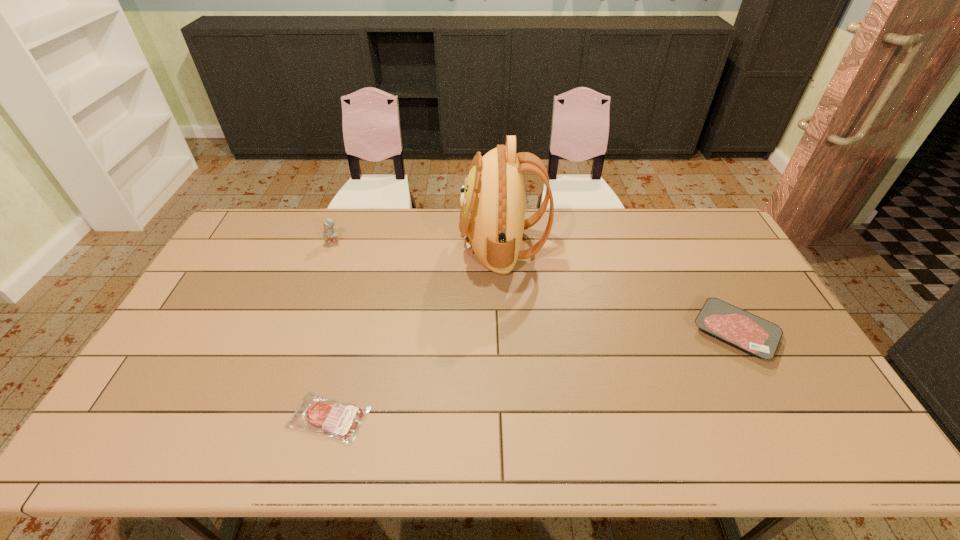
The height and width of the screenshot is (540, 960). Identify the location of free space located 0.080m on the front-facing side of the tallest object. (438, 245).

Locate an element on the screen. Image resolution: width=960 pixels, height=540 pixels. free region located on the front-facing side of the third shortest object is located at coordinates (315, 291).

Identify the location of vacant space located 0.240m on the front of the farther steak. click(798, 453).

In order to click on vacant space located 0.160m on the left of the third object from right to left in this screenshot , I will do `click(223, 417)`.

The height and width of the screenshot is (540, 960). Identify the location of backpack located at the far edge. (492, 219).

The height and width of the screenshot is (540, 960). What are the coordinates of `teddy bear that is positioned at the far edge` in the screenshot? It's located at (330, 235).

What are the coordinates of `object that is at the near edge` in the screenshot? It's located at (340, 421).

Where is `object at the right edge`? The width and height of the screenshot is (960, 540). object at the right edge is located at coordinates (754, 335).

Identify the location of vacant space at the far edge of the desktop. [x=286, y=230].

This screenshot has width=960, height=540. I want to click on free space at the near edge, so click(x=305, y=453).